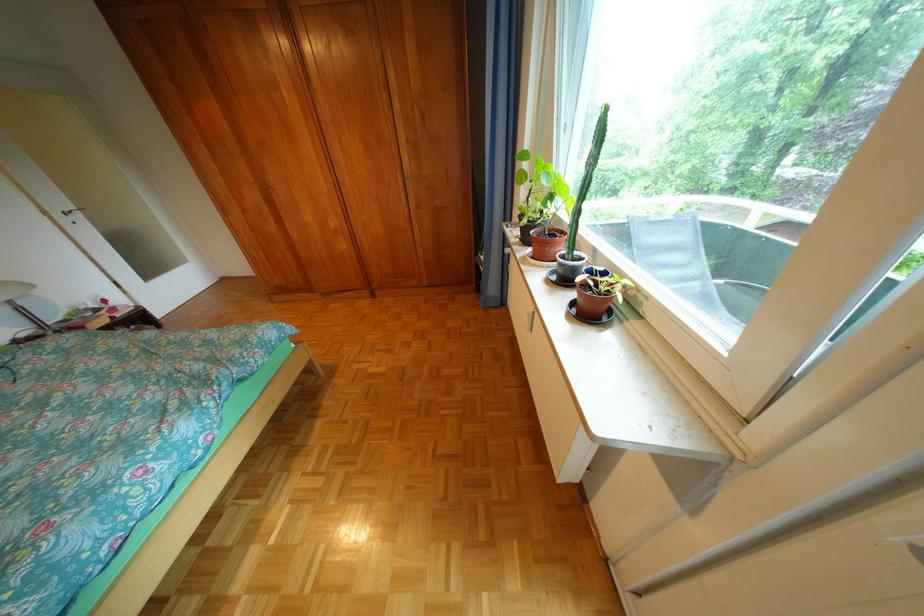
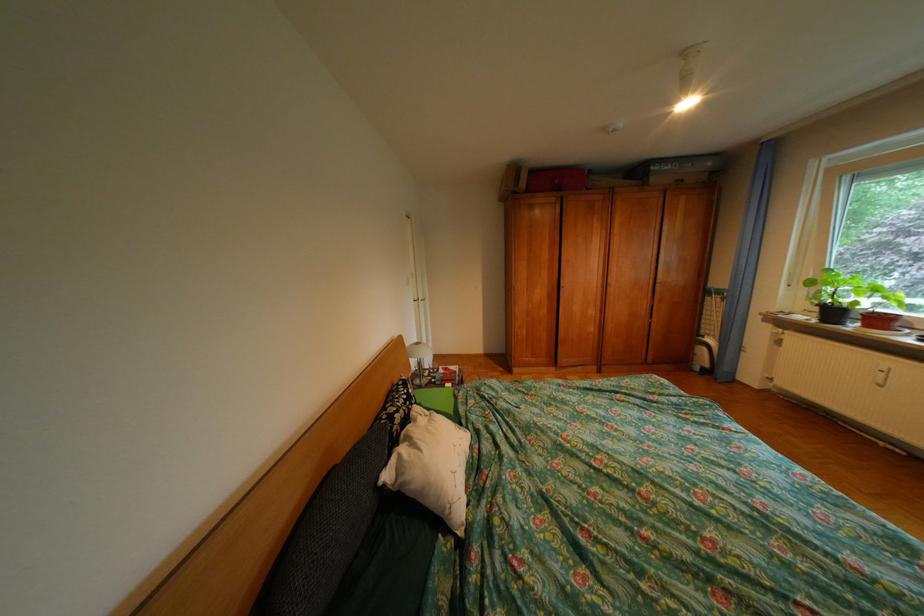
Question: The images are taken continuously from a first-person perspective. In which direction are you moving?

Choices:
 (A) Left
 (B) Right
 (C) Forward
 (D) Backward

Answer: (A)